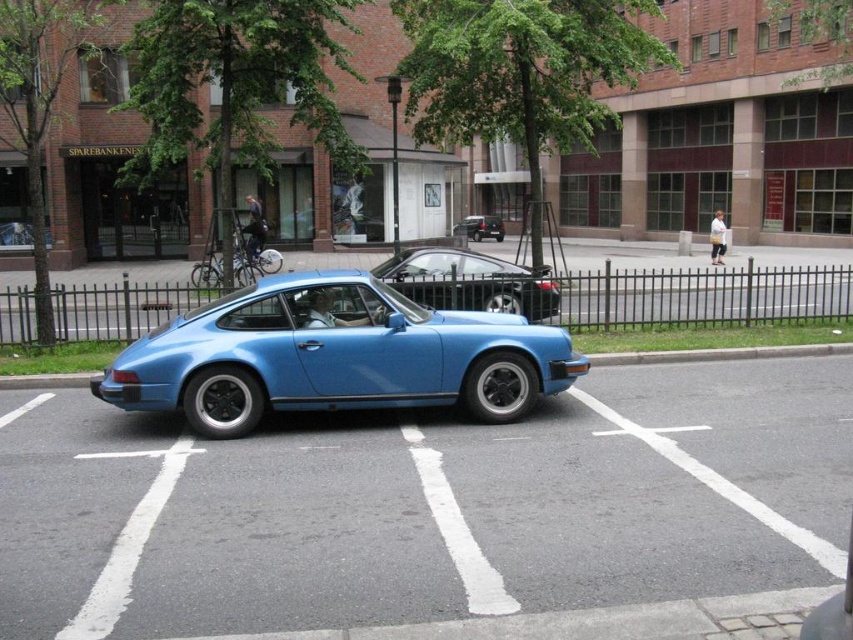
You are a delivery person trying to park your van next to the shiny black car at center and the metallic silver car at center. Which car should you park next to to have more space for your van?

You should park next to the metallic silver car at center because it is wider than the shiny black car at center, providing more space for your van.

Looking at this image, you are a delivery person trying to unload a package from your van parked behind the shiny black car at center and the metallic silver car at center. Which car should you move first to access the parking space?

The shiny black car at center is in front of the metallic silver car at center, so you should move the shiny black car at center first to access the parking space.